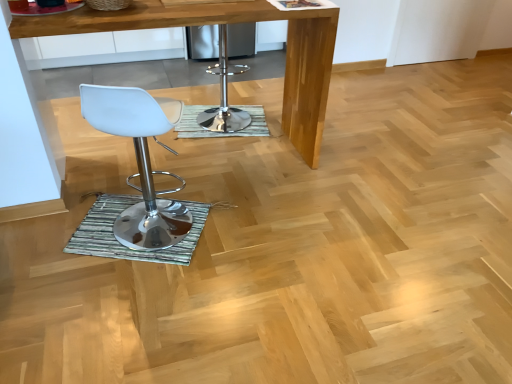
Where is `blank space to the left of white plastic stool at left`? blank space to the left of white plastic stool at left is located at coordinates (98, 223).